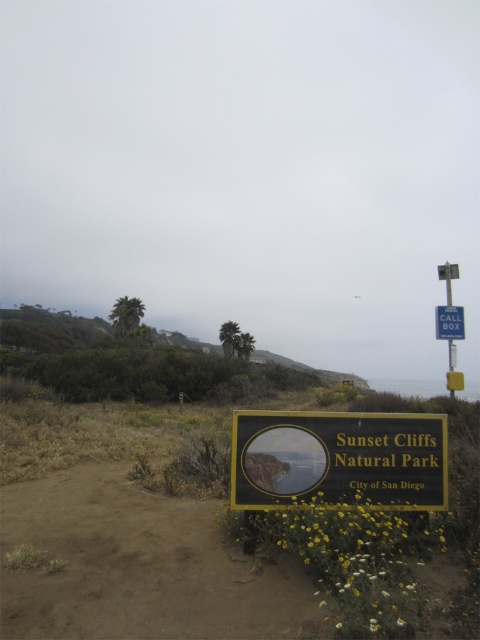
Where is `brown sandy soil at lower center`? The height and width of the screenshot is (640, 480). brown sandy soil at lower center is located at coordinates (139, 564).

Is green leafy vegetation at left to the right of blue metallic call box at upper right from the viewer's perspective?

In fact, green leafy vegetation at left is to the left of blue metallic call box at upper right.

Does green leafy vegetation at left appear on the left side of blue metallic call box at upper right?

Yes, green leafy vegetation at left is to the left of blue metallic call box at upper right.

This screenshot has height=640, width=480. Find the location of `green leafy vegetation at left`. green leafy vegetation at left is located at coordinates (132, 362).

Does point (76, 531) lie behind point (447, 310)?

No, (76, 531) is closer to viewer.

Which of these two, brown sandy soil at lower center or blue plastic call box at upper right, stands taller?

Standing taller between the two is blue plastic call box at upper right.

Between point (206, 582) and point (458, 333), which one is positioned in front?

Positioned in front is point (206, 582).

Where is `brown sandy soil at lower center`? Image resolution: width=480 pixels, height=640 pixels. brown sandy soil at lower center is located at coordinates (139, 564).